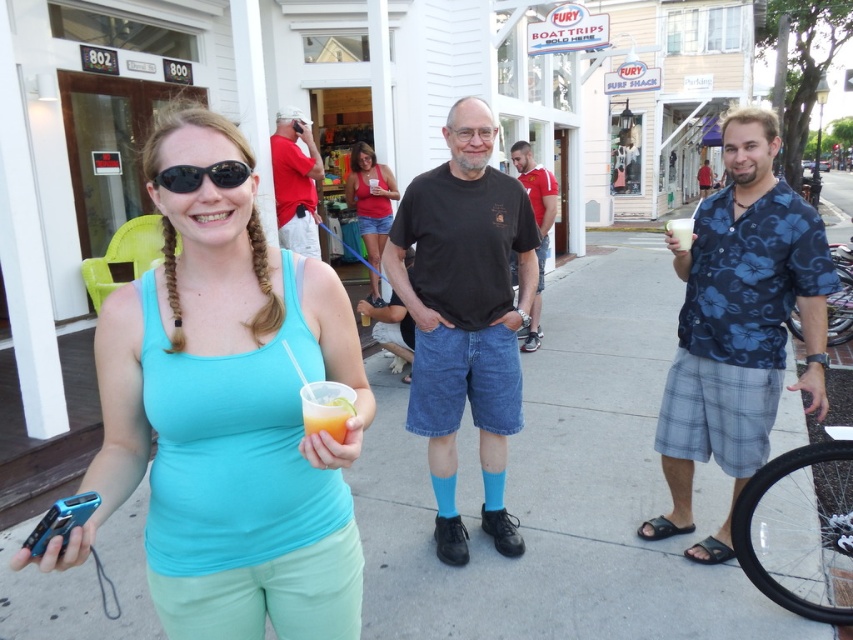
Question: Which object is farther from the camera taking this photo?

Choices:
 (A) blue floral shirt at right
 (B) black matte sunglasses at upper left
 (C) matte teal tank top at center

Answer: (A)

Question: Which of the following is the farthest from the observer?

Choices:
 (A) black matte sunglasses at upper left
 (B) red jersey at center

Answer: (B)

Question: Which object is farther from the camera taking this photo?

Choices:
 (A) black cotton t-shirt at center
 (B) red jersey at center
 (C) blue floral shirt at right
 (D) translucent plastic cup at center

Answer: (B)

Question: Does black cotton t-shirt at center lie behind matte red tank top at center?

Choices:
 (A) yes
 (B) no

Answer: (B)

Question: Does blue floral shirt at right have a greater width compared to red jersey at center?

Choices:
 (A) yes
 (B) no

Answer: (A)

Question: In this image, where is matte red tank top at center located relative to translucent plastic cup at center?

Choices:
 (A) left
 (B) right

Answer: (A)